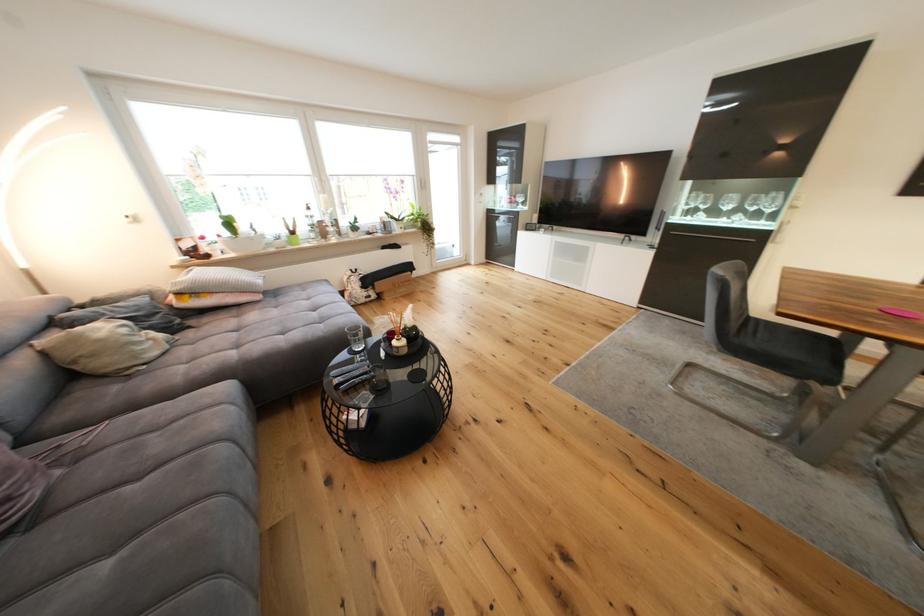
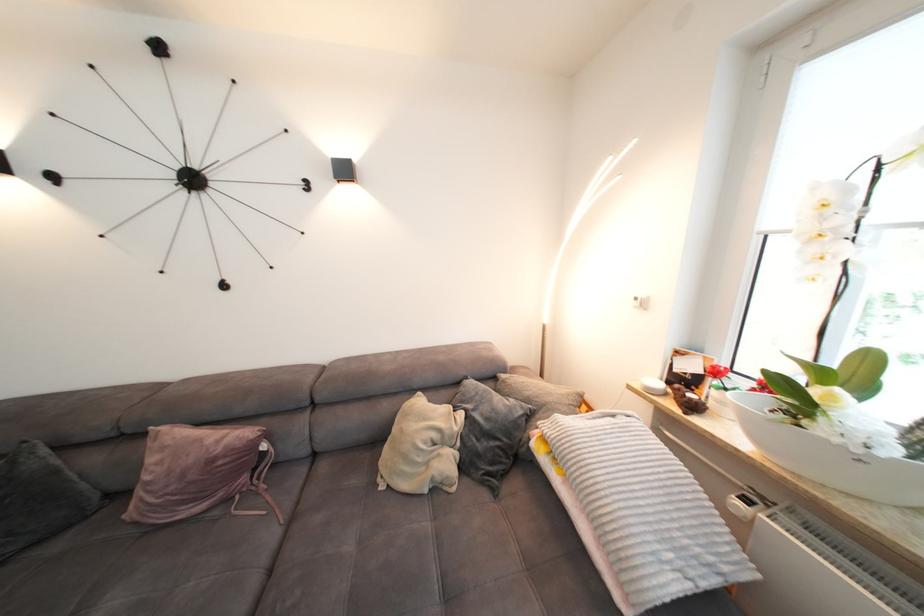
Find the pixel in the second image that matches [70,419] in the first image.

(330, 469)